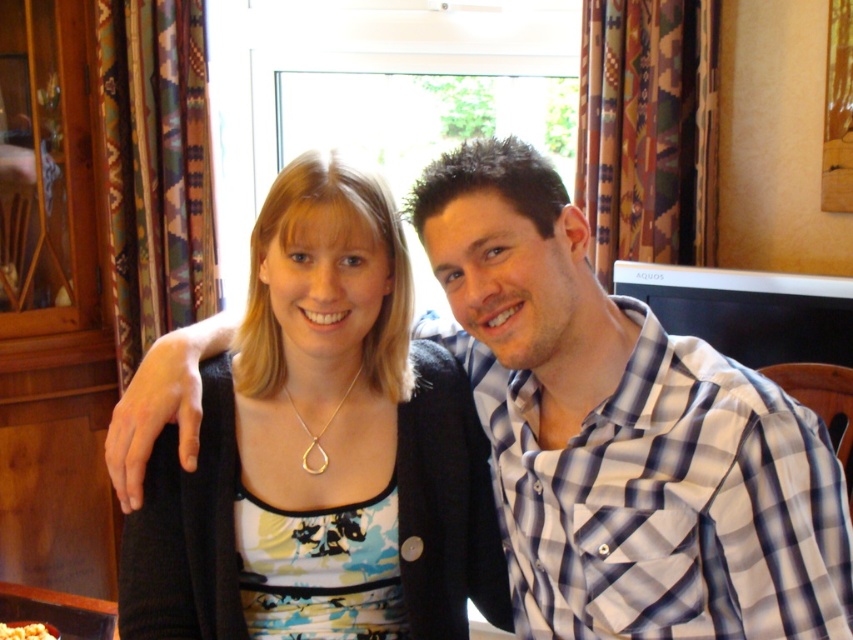
Question: Is matte black cardigan at center wider than white crumbly food at center?

Choices:
 (A) no
 (B) yes

Answer: (B)

Question: Does matte black cardigan at center have a smaller size compared to white crumbly food at center?

Choices:
 (A) no
 (B) yes

Answer: (A)

Question: Which point is farther to the camera?

Choices:
 (A) (10, 621)
 (B) (447, 426)

Answer: (A)

Question: Which point is farther to the camera?

Choices:
 (A) matte black cardigan at center
 (B) white crumbly food at center

Answer: (B)

Question: Is matte black cardigan at center above white crumbly food at center?

Choices:
 (A) yes
 (B) no

Answer: (A)